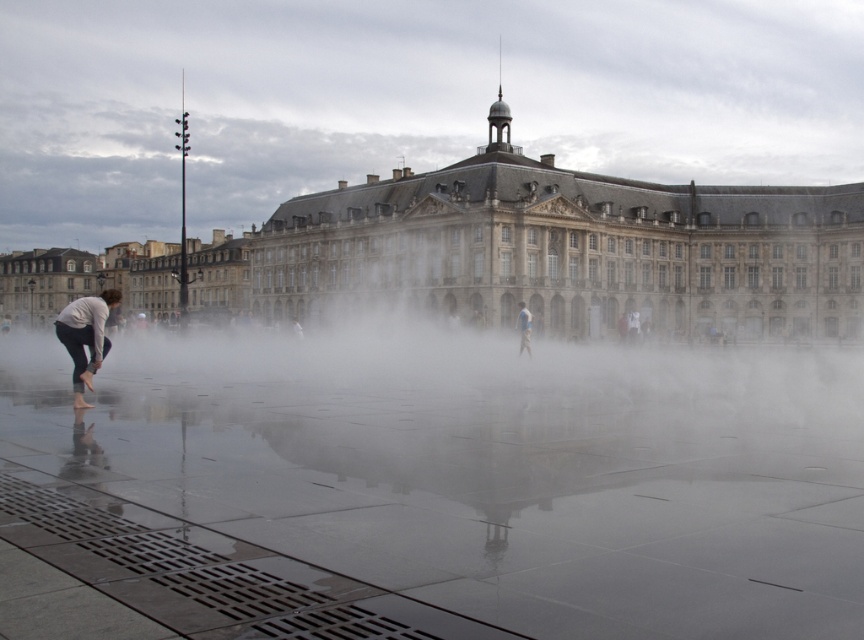
Question: Among these points, which one is farthest from the camera?

Choices:
 (A) (797, 282)
 (B) (530, 324)

Answer: (A)

Question: Which point is farther from the camera taking this photo?

Choices:
 (A) (820, 310)
 (B) (522, 326)

Answer: (A)

Question: Does stone building at center appear on the left side of light gray fabric pants at lower left?

Choices:
 (A) yes
 (B) no

Answer: (A)

Question: Which object appears farthest from the camera in this image?

Choices:
 (A) white fabric person at center
 (B) stone building at center
 (C) light gray fabric pants at lower left

Answer: (B)

Question: Does light gray fabric pants at lower left have a lesser width compared to white fabric person at center?

Choices:
 (A) yes
 (B) no

Answer: (B)

Question: Does light gray fabric pants at lower left appear on the right side of white fabric person at center?

Choices:
 (A) yes
 (B) no

Answer: (B)